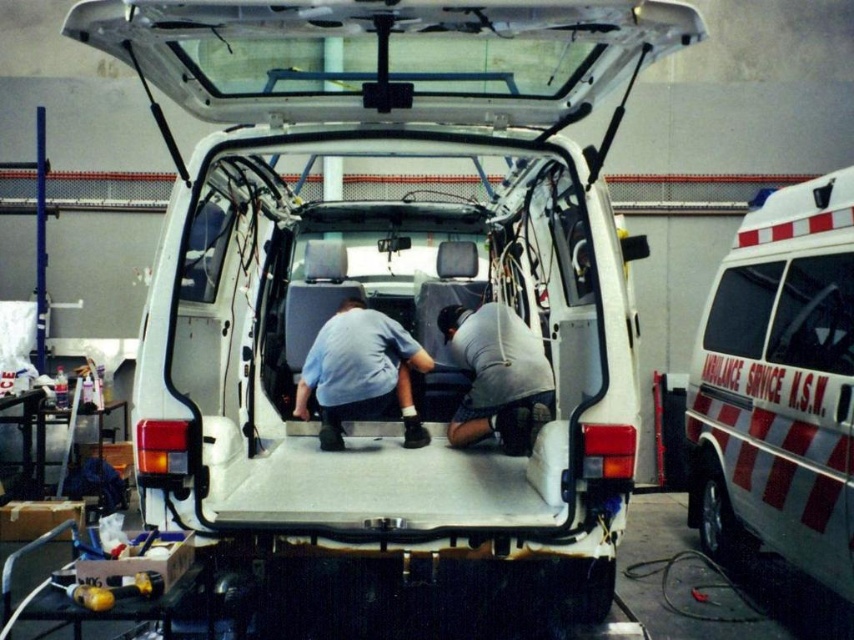
Question: Which object is positioned closest to the blue cotton shirt at center?

Choices:
 (A) gray matte shirt at center
 (B) white glossy ambulance at upper right

Answer: (A)

Question: From the image, what is the correct spatial relationship of white glossy ambulance at right in relation to gray matte shirt at center?

Choices:
 (A) below
 (B) above

Answer: (B)

Question: Which of the following is the closest to the observer?

Choices:
 (A) white glossy ambulance at right
 (B) white glossy ambulance at upper right
 (C) gray matte shirt at center
 (D) blue cotton shirt at center

Answer: (A)

Question: Estimate the real-world distances between objects in this image. Which object is farther from the white glossy ambulance at upper right?

Choices:
 (A) blue cotton shirt at center
 (B) white glossy ambulance at right

Answer: (A)

Question: Is white glossy ambulance at upper right bigger than blue cotton shirt at center?

Choices:
 (A) yes
 (B) no

Answer: (A)

Question: Can you confirm if white glossy ambulance at upper right is bigger than gray matte shirt at center?

Choices:
 (A) no
 (B) yes

Answer: (B)